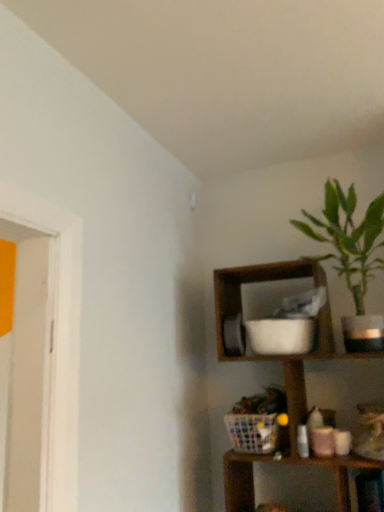
This screenshot has width=384, height=512. What are the coordinates of `green leafy plant at upper right` in the screenshot? It's located at (351, 255).

The image size is (384, 512). What do you see at coordinates (351, 255) in the screenshot?
I see `green leafy plant at upper right` at bounding box center [351, 255].

Describe the element at coordinates (280, 355) in the screenshot. I see `wooden shelf at upper right` at that location.

The width and height of the screenshot is (384, 512). What are the coordinates of `wooden shelf at upper right` in the screenshot? It's located at (280, 355).

You are a GUI agent. You are given a task and a screenshot of the screen. Output one action in this format:
    pyautogui.click(x=<x>, y=<y>)
    Task: Click on the green leafy plant at upper right
    The image size is (384, 512).
    Given the screenshot: What is the action you would take?
    pyautogui.click(x=351, y=255)

Which object is positioned more to the right, green leafy plant at upper right or wooden shelf at upper right?

From the viewer's perspective, green leafy plant at upper right appears more on the right side.

In the image, is green leafy plant at upper right positioned in front of or behind wooden shelf at upper right?

Visually, green leafy plant at upper right is located behind wooden shelf at upper right.

Between point (360, 307) and point (240, 283), which one is positioned behind?

The point (240, 283) is more distant.

From the image's perspective, which is below, green leafy plant at upper right or wooden shelf at upper right?

From the image's view, wooden shelf at upper right is below.

From a real-world perspective, between green leafy plant at upper right and wooden shelf at upper right, who is vertically higher?

green leafy plant at upper right.

In terms of width, does green leafy plant at upper right look wider or thinner when compared to wooden shelf at upper right?

Considering their sizes, green leafy plant at upper right looks slimmer than wooden shelf at upper right.

From the picture: Considering the relative sizes of green leafy plant at upper right and wooden shelf at upper right in the image provided, is green leafy plant at upper right shorter than wooden shelf at upper right?

Yes, green leafy plant at upper right is shorter than wooden shelf at upper right.

Is green leafy plant at upper right smaller than wooden shelf at upper right?

Yes.

Based on the photo, is green leafy plant at upper right spatially inside wooden shelf at upper right, or outside of it?

green leafy plant at upper right is spatially positioned inside wooden shelf at upper right.

Is green leafy plant at upper right not close to wooden shelf at upper right?

No, green leafy plant at upper right is not far from wooden shelf at upper right.

Is green leafy plant at upper right facing away from wooden shelf at upper right?

Yes.

Where is `houseplant to the right of wooden shelf at upper right`? Image resolution: width=384 pixels, height=512 pixels. houseplant to the right of wooden shelf at upper right is located at coordinates (351, 255).

Is wooden shelf at upper right to the left or to the right of green leafy plant at upper right in the image?

From the image, it's evident that wooden shelf at upper right is to the left of green leafy plant at upper right.

Between wooden shelf at upper right and green leafy plant at upper right, which one is positioned behind?

green leafy plant at upper right is more distant.

Which point is more forward, (267, 270) or (338, 191)?

Point (267, 270)

From the image's perspective, who appears lower, wooden shelf at upper right or green leafy plant at upper right?

wooden shelf at upper right appears lower in the image.

From a real-world perspective, which is physically above, wooden shelf at upper right or green leafy plant at upper right?

green leafy plant at upper right.

Is wooden shelf at upper right wider than green leafy plant at upper right?

Yes.

Between wooden shelf at upper right and green leafy plant at upper right, which one has less height?

green leafy plant at upper right is shorter.

Between wooden shelf at upper right and green leafy plant at upper right, which one has larger size?

Bigger between the two is wooden shelf at upper right.

Is wooden shelf at upper right not within green leafy plant at upper right?

That's correct, wooden shelf at upper right is outside of green leafy plant at upper right.

Is wooden shelf at upper right far from green leafy plant at upper right?

No, wooden shelf at upper right is in close proximity to green leafy plant at upper right.

Is wooden shelf at upper right oriented away from green leafy plant at upper right?

No, green leafy plant at upper right is not at the back of wooden shelf at upper right.

Where is `shelf below the green leafy plant at upper right (from a real-world perspective)`? Image resolution: width=384 pixels, height=512 pixels. shelf below the green leafy plant at upper right (from a real-world perspective) is located at coordinates (280, 355).

What are the coordinates of `houseplant above the wooden shelf at upper right (from the image's perspective)` in the screenshot? It's located at pyautogui.click(x=351, y=255).

Locate an element on the screen. The image size is (384, 512). houseplant that is above the wooden shelf at upper right (from a real-world perspective) is located at coordinates (351, 255).